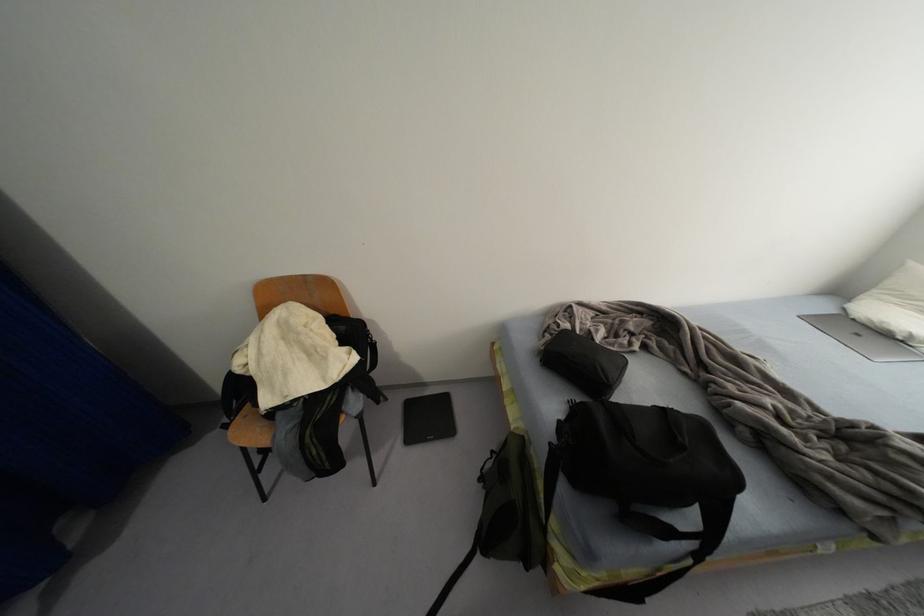
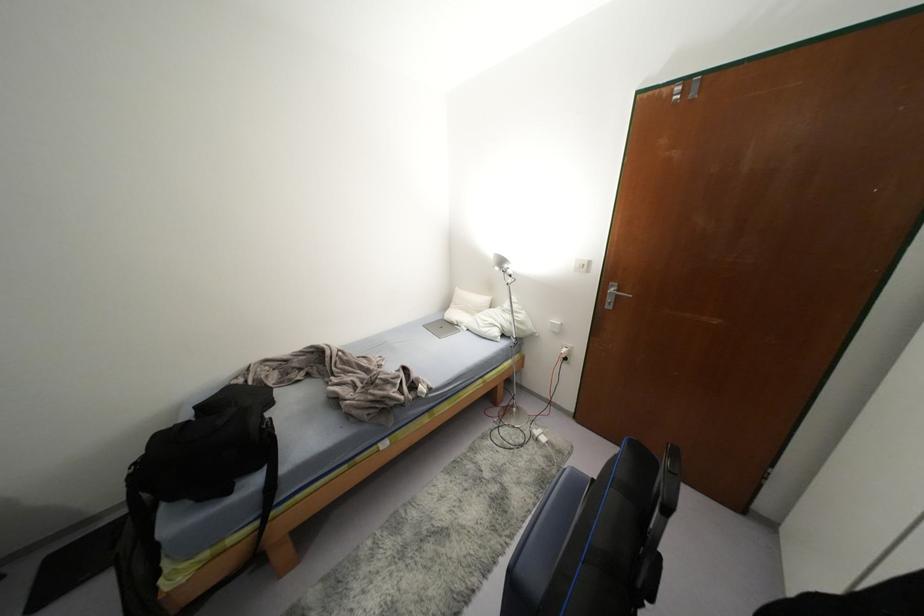
Find the pixel in the second image that matches the point at 882,338 in the first image.

(452, 325)